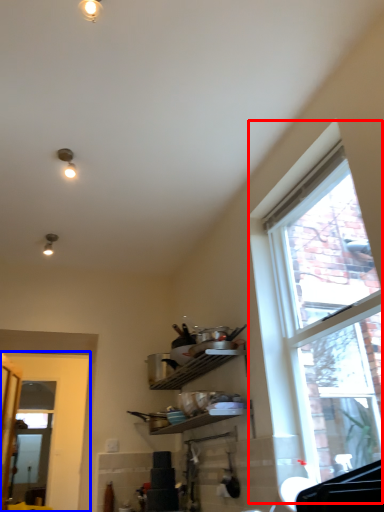
Question: Which point is closer to the camera, window (highlighted by a red box) or door (highlighted by a blue box)?

Choices:
 (A) window
 (B) door

Answer: (A)